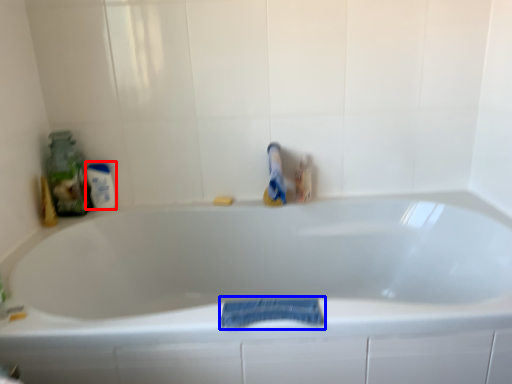
Question: Which object appears closest to the camera in this image, mouthwash (highlighted by a red box) or bath towel (highlighted by a blue box)?

Choices:
 (A) mouthwash
 (B) bath towel

Answer: (B)